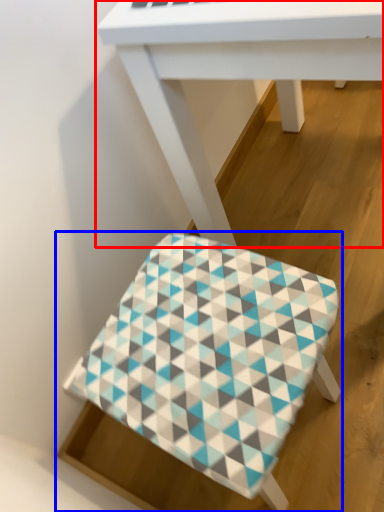
Question: Which object is closer to the camera taking this photo, table (highlighted by a red box) or stool (highlighted by a blue box)?

Choices:
 (A) table
 (B) stool

Answer: (A)